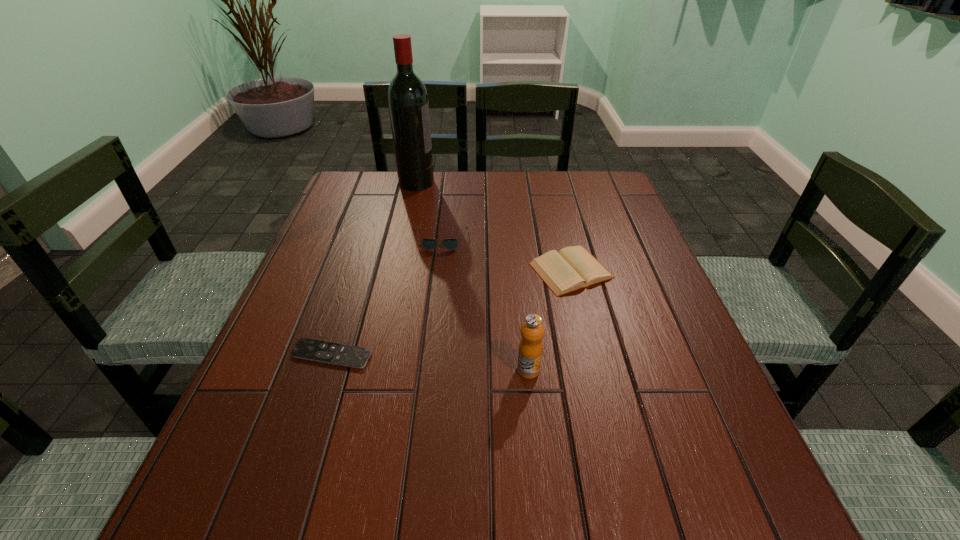
I want to click on free point between the wine bottle and the sunglasses, so click(x=429, y=211).

Where is `vacant space that's between the diary and the third shortest object`? Image resolution: width=960 pixels, height=540 pixels. vacant space that's between the diary and the third shortest object is located at coordinates (506, 255).

Locate an element on the screen. vacant area that lies between the sunglasses and the orange juice is located at coordinates (485, 305).

What are the coordinates of `object that can be found as the fourth closest to the diary` in the screenshot? It's located at (408, 104).

Identify the location of object that can be found as the closest to the third tallest object. (572, 268).

Where is `free point that satisfies the following two spatial constraints: 1. on the label of the tallest object; 2. on the left side of the rightmost object`? The height and width of the screenshot is (540, 960). free point that satisfies the following two spatial constraints: 1. on the label of the tallest object; 2. on the left side of the rightmost object is located at coordinates (397, 271).

Identify the location of free region that satisfies the following two spatial constraints: 1. on the back side of the remote control; 2. on the left side of the rightmost object. The width and height of the screenshot is (960, 540). (359, 271).

Locate an element on the screen. Image resolution: width=960 pixels, height=540 pixels. free point that satisfies the following two spatial constraints: 1. on the label of the rightmost object; 2. on the right side of the tallest object is located at coordinates (397, 271).